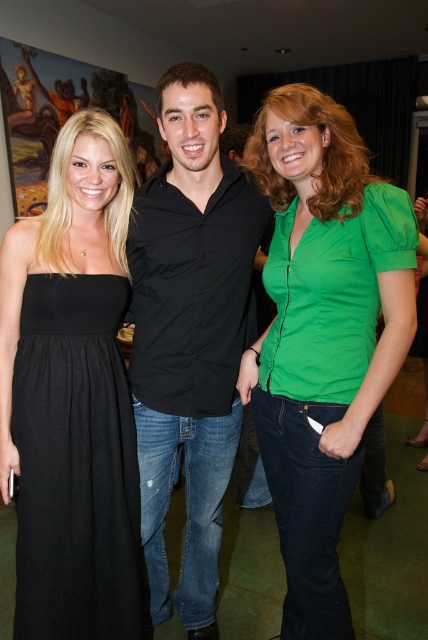
Which is more to the right, green matte shirt at center or black cotton dress at left?

From the viewer's perspective, green matte shirt at center appears more on the right side.

Is green matte shirt at center to the left of black cotton dress at left from the viewer's perspective?

Incorrect, green matte shirt at center is not on the left side of black cotton dress at left.

Who is more distant from viewer, (303, 621) or (21, 509)?

The point (303, 621) is behind.

Identify the location of green matte shirt at center. (323, 333).

Does green matte shirt at center appear under black smooth shirt at center?

Yes, green matte shirt at center is below black smooth shirt at center.

Between green matte shirt at center and black smooth shirt at center, which one has more height?

black smooth shirt at center is taller.

In order to click on green matte shirt at center in this screenshot , I will do `click(323, 333)`.

Does black smooth shirt at center appear over black cotton dress at left?

Correct, black smooth shirt at center is located above black cotton dress at left.

Which is more to the left, black smooth shirt at center or black cotton dress at left?

From the viewer's perspective, black cotton dress at left appears more on the left side.

Which is behind, point (187, 403) or point (56, 440)?

The point (187, 403) is behind.

This screenshot has height=640, width=428. I want to click on black smooth shirt at center, so click(x=190, y=333).